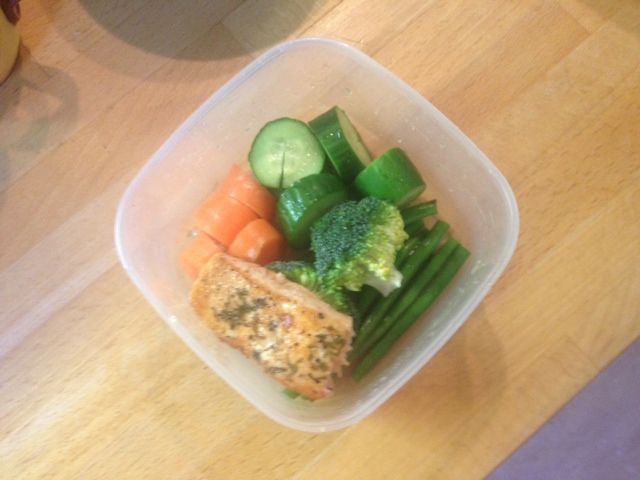
Locate an element on the screen. The image size is (640, 480). grey floor is located at coordinates (582, 442).